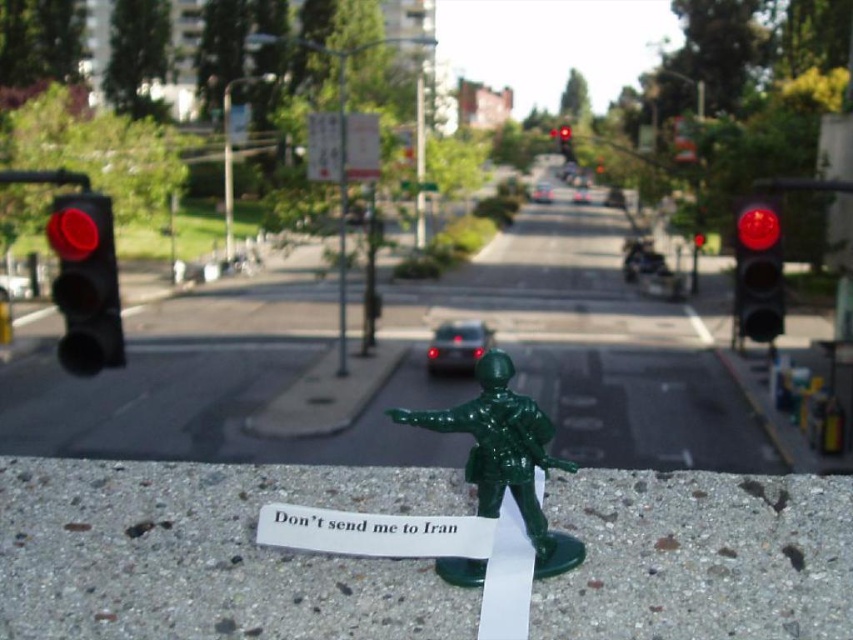
Question: Does black matte traffic light at left have a smaller size compared to red matte traffic light at right?

Choices:
 (A) no
 (B) yes

Answer: (A)

Question: Which object is the farthest from the green plastic toy soldier at center?

Choices:
 (A) red matte traffic light at center
 (B) red matte traffic light at right
 (C) black matte traffic light at left

Answer: (A)

Question: Is black matte traffic light at left thinner than red matte traffic light at center?

Choices:
 (A) yes
 (B) no

Answer: (B)

Question: Estimate the real-world distances between objects in this image. Which object is closer to the black matte traffic light at left?

Choices:
 (A) red matte traffic light at right
 (B) green plastic toy soldier at center

Answer: (B)

Question: Which is farther from the red matte traffic light at center?

Choices:
 (A) green plastic toy soldier at center
 (B) red matte traffic light at right
 (C) black matte traffic light at left

Answer: (A)

Question: Does green plastic toy soldier at center have a greater width compared to red matte traffic light at center?

Choices:
 (A) yes
 (B) no

Answer: (A)